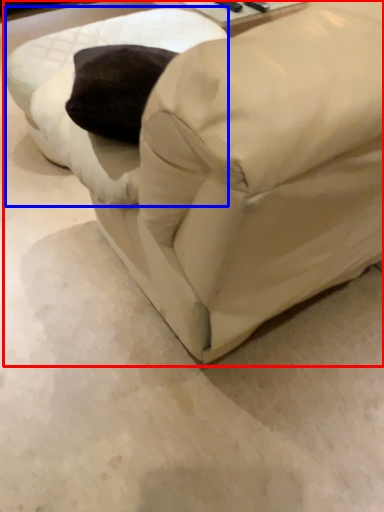
Question: Which object appears closest to the camera in this image, furniture (highlighted by a red box) or swivel chair (highlighted by a blue box)?

Choices:
 (A) furniture
 (B) swivel chair

Answer: (A)